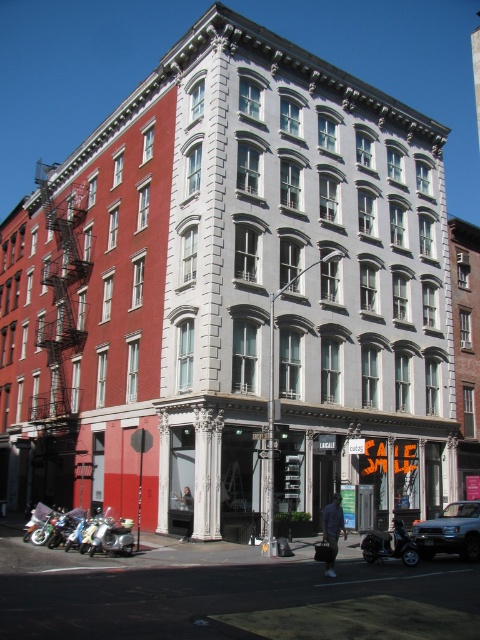
Question: Can you confirm if metallic silver suv at center is positioned below shiny chrome motorcycle at lower left?

Choices:
 (A) no
 (B) yes

Answer: (B)

Question: Which point is closer to the camera?

Choices:
 (A) metallic silver suv at center
 (B) silver metallic motorcycle at lower left
 (C) shiny chrome motorcycle at lower right
 (D) shiny chrome motorcycle at lower left

Answer: (C)

Question: Which of the following is the closest to the observer?

Choices:
 (A) (463, 518)
 (B) (69, 525)
 (C) (396, 536)

Answer: (C)

Question: Which point is closer to the camera?

Choices:
 (A) (129, 541)
 (B) (405, 531)

Answer: (B)

Question: Can you confirm if metallic silver suv at center is wider than shiny chrome motorcycle at lower right?

Choices:
 (A) yes
 (B) no

Answer: (A)

Question: Can you confirm if shiny chrome motorcycle at lower right is smaller than shiny chrome motorcycle at lower left?

Choices:
 (A) yes
 (B) no

Answer: (B)